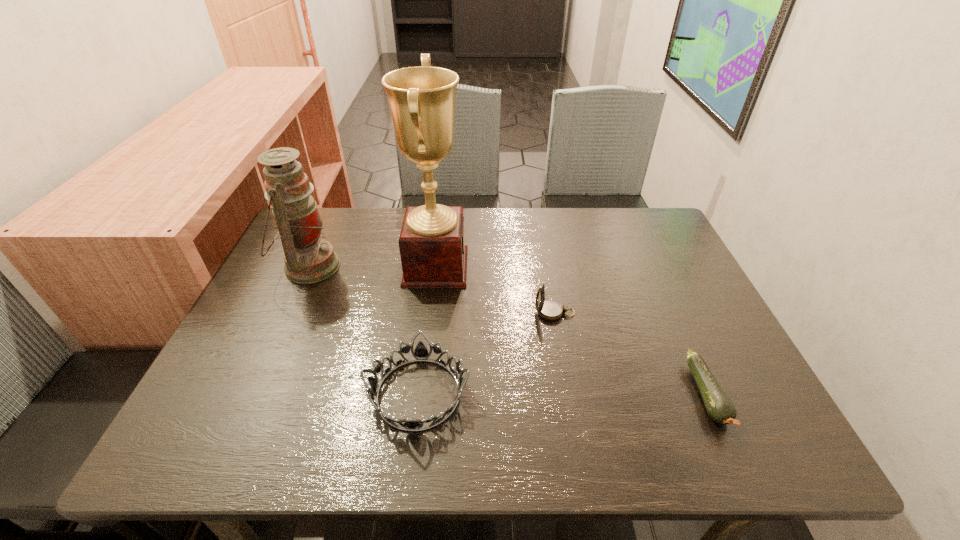
Where is `trophy cup`? The image size is (960, 540). trophy cup is located at coordinates (422, 99).

You are a GUI agent. You are given a task and a screenshot of the screen. Output one action in this format:
    pyautogui.click(x=<x>, y=<y>)
    Task: Click on the leftmost object
    The width and height of the screenshot is (960, 540).
    Given the screenshot: What is the action you would take?
    pyautogui.click(x=308, y=259)

This screenshot has height=540, width=960. In order to click on oil lamp in this screenshot , I will do `click(308, 259)`.

Find the location of `the third farthest object`. the third farthest object is located at coordinates (551, 310).

Identify the location of the second object from right to left. (551, 310).

I want to click on tiara, so click(x=421, y=353).

I want to click on zucchini, so click(x=719, y=406).

Find the location of a particular element. The height and width of the screenshot is (540, 960). the rightmost object is located at coordinates (719, 406).

Identify the location of free space located on the plaque of the trophy cup. This screenshot has width=960, height=540. (538, 267).

Where is `free region located 0.070m on the front of the leftmost object`? free region located 0.070m on the front of the leftmost object is located at coordinates (288, 314).